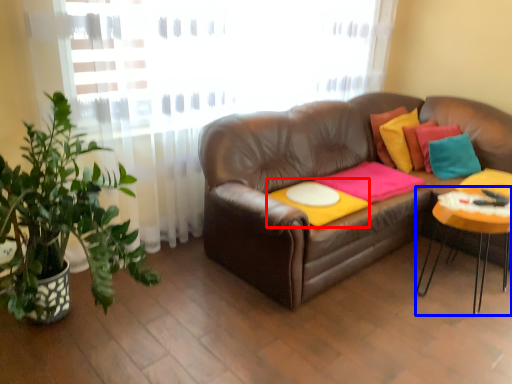
Question: Which point is further to the camera, round table (highlighted by a red box) or table (highlighted by a blue box)?

Choices:
 (A) round table
 (B) table

Answer: (A)